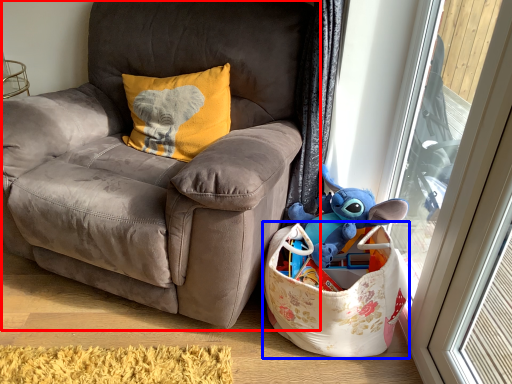
Question: Which object is closer to the camera taking this photo, chair (highlighted by a red box) or gift basket (highlighted by a blue box)?

Choices:
 (A) chair
 (B) gift basket

Answer: (A)